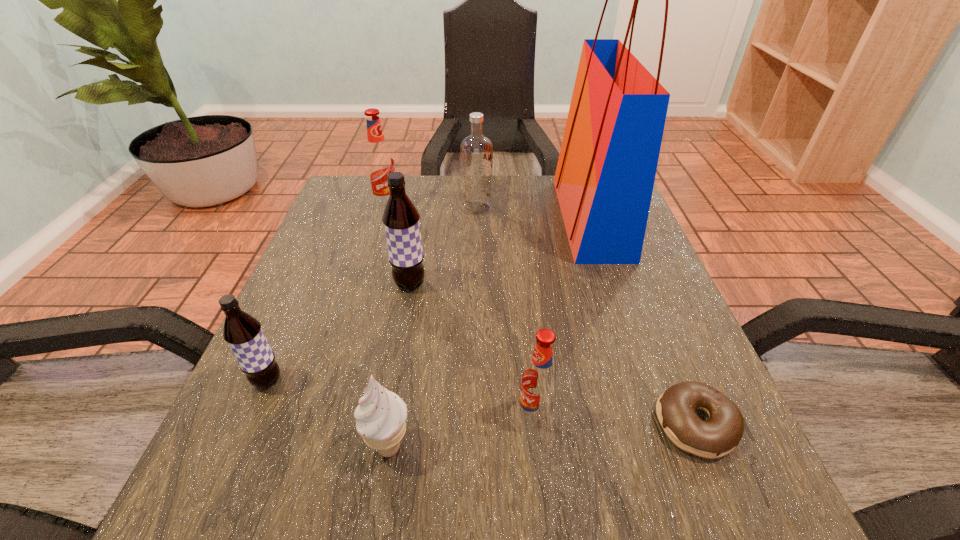
You are a GUI agent. You are given a task and a screenshot of the screen. Output one action in this format:
    pyautogui.click(x=<x>, y=<y>)
    Task: Click on the object present at the far left corner
    Image resolution: width=960 pixels, height=540 pixels.
    Given the screenshot: What is the action you would take?
    pyautogui.click(x=379, y=161)

At what (x,y) coordinates should I click in order to perform the action: click on object that is at the far right corner. Please return your answer as a coordinate pair (x, y). The height and width of the screenshot is (540, 960). Looking at the image, I should click on (604, 180).

Locate an element on the screen. This screenshot has height=540, width=960. vacant area at the far edge of the desktop is located at coordinates click(522, 182).

Locate an element on the screen. The image size is (960, 540). vacant space at the near edge of the desktop is located at coordinates (437, 496).

The image size is (960, 540). In the image, there is a desktop. What are the coordinates of `vacant space at the left edge` in the screenshot? It's located at (330, 274).

The height and width of the screenshot is (540, 960). Identify the location of vacant space at the right edge of the desktop. (611, 296).

Image resolution: width=960 pixels, height=540 pixels. In order to click on free location at the far left corner in this screenshot , I will do `click(336, 222)`.

Find the location of a particular element. The image size is (960, 540). vacant space at the near left corner is located at coordinates (252, 474).

Find the location of `free spot between the shopping bag and the nearest root beer`. free spot between the shopping bag and the nearest root beer is located at coordinates (563, 317).

I want to click on empty space that is in between the right brown root beer and the leftmost root beer, so click(339, 332).